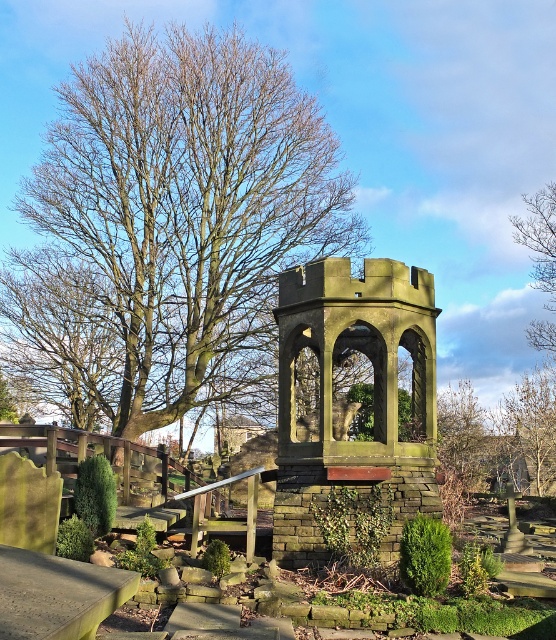
You are a gardener planning to trim the bare branches at upper right and the green leafy hedge at lower left. Which of these two plants requires more attention due to its size?

The bare branches at upper right requires more attention because it is bigger than the green leafy hedge at lower left.

You are a gardener planning to place a new decorative statue in the cemetery. The statue requires a base that is wider than the green stone gazebo at center. Can you use the area near the bare branches at upper right for this purpose?

The green stone gazebo at center is thinner than the bare branches at upper right. Since the statue requires a base wider than the gazebo, the area near the bare branches at upper right is suitable as it is wider.